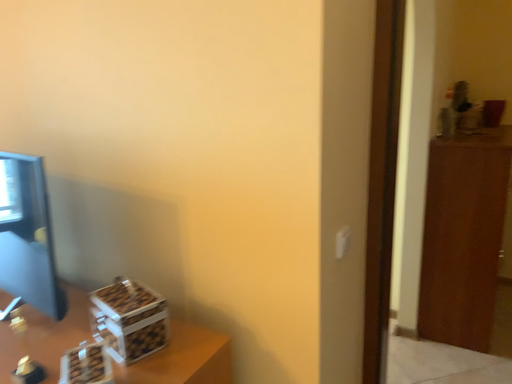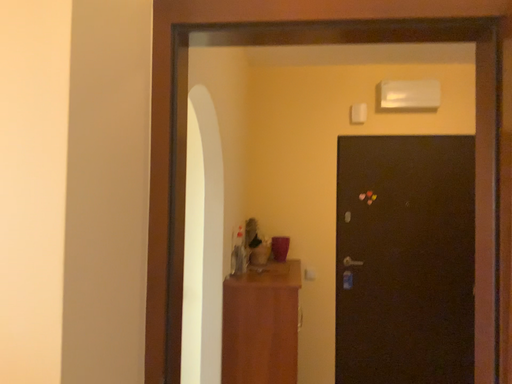
Question: How did the camera likely rotate when shooting the video?

Choices:
 (A) rotated downward
 (B) rotated upward

Answer: (B)